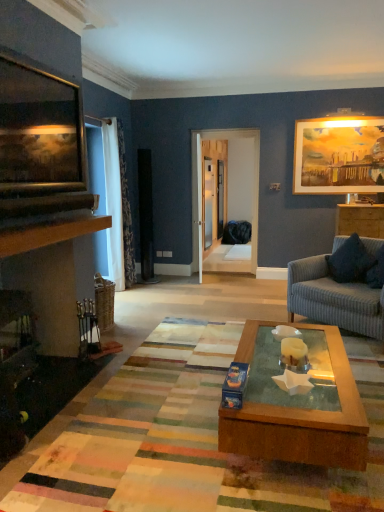
In order to click on matte wooden picture frame at upper right, which ranks as the second picture frame in front-to-back order in this screenshot , I will do `click(339, 155)`.

Describe the element at coordinates (339, 155) in the screenshot. I see `matte wooden picture frame at upper right, the 2th picture frame from the left` at that location.

Image resolution: width=384 pixels, height=512 pixels. Identify the location of striped fabric couch at right. (333, 298).

What do you see at coordinates (39, 130) in the screenshot? I see `wooden picture frame at upper left, arranged as the 1th picture frame when viewed from the left` at bounding box center [39, 130].

Locate an element on the screen. The image size is (384, 512). white floral fabric curtain at left is located at coordinates (113, 203).

The width and height of the screenshot is (384, 512). What do you see at coordinates (360, 220) in the screenshot? I see `wooden cabinet at right` at bounding box center [360, 220].

Locate an element on the screen. wooden cabinet at right is located at coordinates (360, 220).

This screenshot has height=512, width=384. What are the coordinates of `matte wooden picture frame at upper right, which appears as the 1th picture frame when viewed from the right` in the screenshot? It's located at (339, 155).

In order to click on picture frame behind the white floral fabric curtain at left in this screenshot , I will do `click(339, 155)`.

Between white floral fabric curtain at left and matte wooden picture frame at upper right, marked as the first picture frame in a back-to-front arrangement, which one appears on the left side from the viewer's perspective?

white floral fabric curtain at left is more to the left.

Looking at this image, from the image's perspective, is white floral fabric curtain at left located beneath matte wooden picture frame at upper right, which appears as the 1th picture frame when viewed from the right?

Correct, white floral fabric curtain at left appears lower than matte wooden picture frame at upper right, which appears as the 1th picture frame when viewed from the right, in the image.

From a real-world perspective, is white floral fabric curtain at left positioned under matte wooden picture frame at upper right, the 2th picture frame from the left, based on gravity?

Correct, in the physical world, white floral fabric curtain at left is lower than matte wooden picture frame at upper right, the 2th picture frame from the left.

Is wooden cabinet at right in contact with white floral fabric curtain at left?

wooden cabinet at right and white floral fabric curtain at left are clearly separated.

From the image's perspective, which one is positioned higher, wooden cabinet at right or white floral fabric curtain at left?

From the image's view, white floral fabric curtain at left is above.

Does point (345, 205) appear closer or farther from the camera than point (113, 129)?

Point (345, 205) is positioned closer to the camera compared to point (113, 129).

Between point (382, 134) and point (48, 134), which one is positioned behind?

Positioned behind is point (382, 134).

Does matte wooden picture frame at upper right, marked as the first picture frame in a back-to-front arrangement, have a greater width compared to wooden picture frame at upper left, the 2th picture frame when ordered from back to front?

In fact, matte wooden picture frame at upper right, marked as the first picture frame in a back-to-front arrangement, might be narrower than wooden picture frame at upper left, the 2th picture frame when ordered from back to front.

From a real-world perspective, does matte wooden picture frame at upper right, marked as the first picture frame in a back-to-front arrangement, sit lower than wooden picture frame at upper left, the first picture frame in the front-to-back sequence?

Yes, from a real-world perspective, matte wooden picture frame at upper right, marked as the first picture frame in a back-to-front arrangement, is under wooden picture frame at upper left, the first picture frame in the front-to-back sequence.

Consider the image. Does matte wooden picture frame at upper right, the 2th picture frame from the left, have a greater height compared to wooden picture frame at upper left, arranged as the 1th picture frame when viewed from the left?

Yes.

Is striped fabric couch at right at the right side of multicolored woven mat at center?

Correct, you'll find striped fabric couch at right to the right of multicolored woven mat at center.

From the image's perspective, would you say striped fabric couch at right is positioned over multicolored woven mat at center?

Yes, from the image's perspective, striped fabric couch at right is above multicolored woven mat at center.

The image size is (384, 512). In order to click on studio couch lying behind the multicolored woven mat at center in this screenshot , I will do `click(333, 298)`.

Can multicolored woven mat at center be found inside striped fabric couch at right?

That's incorrect, multicolored woven mat at center is not inside striped fabric couch at right.

Where is `curtain located on the left of multicolored woven mat at center`? curtain located on the left of multicolored woven mat at center is located at coordinates (113, 203).

Is the position of white floral fabric curtain at left more distant than that of multicolored woven mat at center?

That is True.

Considering the sizes of objects white floral fabric curtain at left and multicolored woven mat at center in the image provided, who is wider, white floral fabric curtain at left or multicolored woven mat at center?

multicolored woven mat at center.

Considering the positions of point (107, 234) and point (107, 471), is point (107, 234) closer or farther from the camera than point (107, 471)?

Point (107, 234) is farther from the camera than point (107, 471).

Based on the photo, which of these two, wooden picture frame at upper left, the first picture frame in the front-to-back sequence, or multicolored woven mat at center, stands shorter?

multicolored woven mat at center is shorter.

From the image's perspective, which is above, wooden picture frame at upper left, which ranks as the second picture frame in right-to-left order, or multicolored woven mat at center?

wooden picture frame at upper left, which ranks as the second picture frame in right-to-left order, appears higher in the image.

Is wooden picture frame at upper left, the first picture frame in the front-to-back sequence, oriented away from multicolored woven mat at center?

wooden picture frame at upper left, the first picture frame in the front-to-back sequence, is not turned away from multicolored woven mat at center.

Is wooden picture frame at upper left, the 2th picture frame when ordered from back to front, looking in the opposite direction of wooden cabinet at right?

No, wooden picture frame at upper left, the 2th picture frame when ordered from back to front, is not facing the opposite direction of wooden cabinet at right.

Does wooden picture frame at upper left, arranged as the 1th picture frame when viewed from the left, have a greater width compared to wooden cabinet at right?

Incorrect, the width of wooden picture frame at upper left, arranged as the 1th picture frame when viewed from the left, does not surpass that of wooden cabinet at right.

Is wooden picture frame at upper left, arranged as the 1th picture frame when viewed from the left, in contact with wooden cabinet at right?

No, wooden picture frame at upper left, arranged as the 1th picture frame when viewed from the left, is not next to wooden cabinet at right.

From the image's perspective, which object appears higher, wooden picture frame at upper left, the first picture frame in the front-to-back sequence, or wooden cabinet at right?

wooden picture frame at upper left, the first picture frame in the front-to-back sequence, appears higher in the image.

Where is `picture frame on the right of white floral fabric curtain at left`? picture frame on the right of white floral fabric curtain at left is located at coordinates click(x=339, y=155).

I want to click on cabinetry below the white floral fabric curtain at left (from a real-world perspective), so click(x=360, y=220).

Based on their spatial positions, is dark blue textured pillow at right or matte wooden picture frame at upper right, the 2th picture frame from the left, further from wooden picture frame at upper left, which ranks as the second picture frame in right-to-left order?

matte wooden picture frame at upper right, the 2th picture frame from the left, is positioned further to the anchor wooden picture frame at upper left, which ranks as the second picture frame in right-to-left order.

Which object lies nearer to the anchor point matte wooden picture frame at upper right, which ranks as the second picture frame in front-to-back order, multicolored woven mat at center or white floral fabric curtain at left?

Based on the image, white floral fabric curtain at left appears to be nearer to matte wooden picture frame at upper right, which ranks as the second picture frame in front-to-back order.

Based on their spatial positions, is matte wooden picture frame at upper right, which ranks as the second picture frame in front-to-back order, or wooden picture frame at upper left, which ranks as the second picture frame in right-to-left order, further from dark blue textured pillow at right?

wooden picture frame at upper left, which ranks as the second picture frame in right-to-left order, is further to dark blue textured pillow at right.

Based on their spatial positions, is matte wooden picture frame at upper right, which appears as the 1th picture frame when viewed from the right, or white floral fabric curtain at left closer to wooden cabinet at right?

matte wooden picture frame at upper right, which appears as the 1th picture frame when viewed from the right, is positioned closer to the anchor wooden cabinet at right.

Based on their spatial positions, is wooden picture frame at upper left, the 2th picture frame when ordered from back to front, or matte wooden picture frame at upper right, marked as the first picture frame in a back-to-front arrangement, closer to dark blue textured pillow at right?

Among the two, matte wooden picture frame at upper right, marked as the first picture frame in a back-to-front arrangement, is located nearer to dark blue textured pillow at right.

Looking at the image, which one is located closer to dark blue textured pillow at right, white floral fabric curtain at left or matte wooden picture frame at upper right, the 2th picture frame from the left?

matte wooden picture frame at upper right, the 2th picture frame from the left, lies closer to dark blue textured pillow at right than the other object.

Looking at this image, from the image, which object appears to be nearer to wooden picture frame at upper left, the 2th picture frame when ordered from back to front, white floral fabric curtain at left or striped fabric couch at right?

white floral fabric curtain at left.

When comparing their distances from dark blue textured pillow at right, does multicolored woven mat at center or wooden cabinet at right seem further?

multicolored woven mat at center.

The width and height of the screenshot is (384, 512). Identify the location of curtain located between multicolored woven mat at center and wooden cabinet at right in the depth direction. (113, 203).

Find the location of a particular element. studio couch between white floral fabric curtain at left and wooden cabinet at right is located at coordinates (333, 298).

Image resolution: width=384 pixels, height=512 pixels. I want to click on pillow between white floral fabric curtain at left and matte wooden picture frame at upper right, marked as the first picture frame in a back-to-front arrangement, so click(351, 261).

Find the location of `picture frame between white floral fabric curtain at left and wooden cabinet at right from left to right`. picture frame between white floral fabric curtain at left and wooden cabinet at right from left to right is located at coordinates (339, 155).